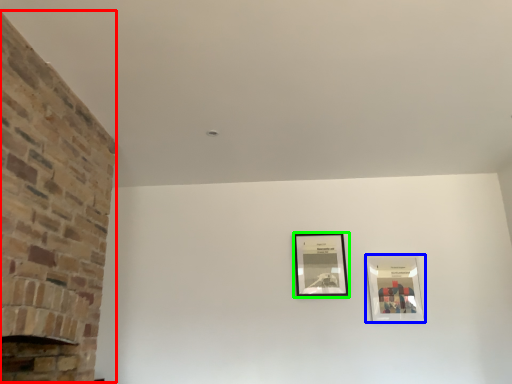
Question: Estimate the real-world distances between objects in this image. Which object is farther from fireplace (highlighted by a red box), picture frame (highlighted by a blue box) or picture frame (highlighted by a green box)?

Choices:
 (A) picture frame
 (B) picture frame

Answer: (A)